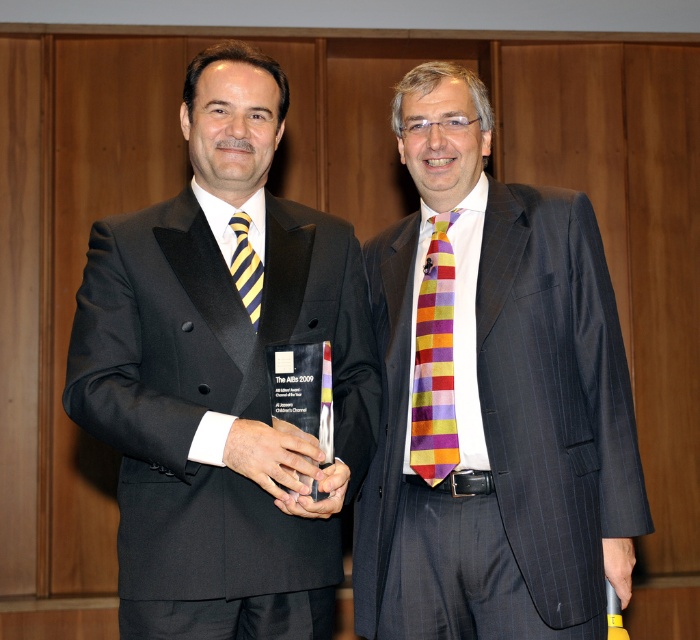
You are a photographer adjusting your camera to focus on the striped silk tie at center. What coordinates should you set to ensure the tie is in the center of your frame?

The striped silk tie at center is located at coordinates point (x=491, y=397), so you should set your camera to focus at those coordinates to center the tie.

Consider the image. You are a photographer at an award ceremony. You want to capture a closeup of the multicolored striped tie at center. Given that your camera focuses on the point at point (434,360), will the multicolored striped tie at center be in focus?

The multicolored striped tie at center is represented by point (434,360), so yes, the multicolored striped tie at center will be in focus since the camera focuses on that point.

Based on the photo, you are a photographer at an award ceremony. You need to capture a closeup shot of both the multicolored striped tie at center and the yellow striped tie at left. The camera you are using has a maximum focus range of 40 centimeters. Can you capture both ties in one shot without moving the camera?

The distance between the multicolored striped tie at center and the yellow striped tie at left is 42.75 centimeters, which exceeds the camera maximum focus range of 40 centimeters. Therefore, you cannot capture both ties in one shot without moving the camera.